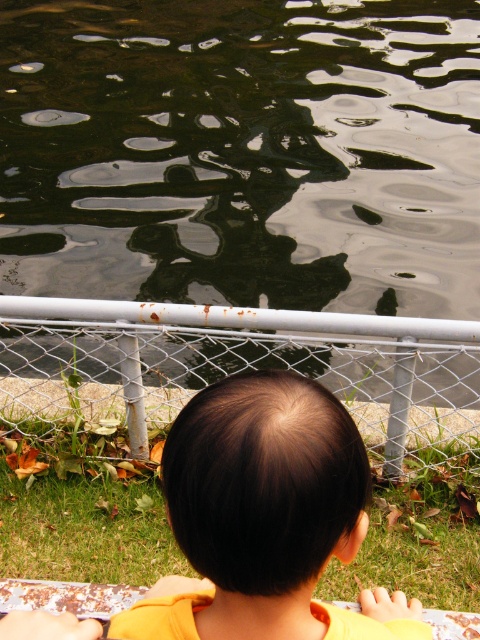
Question: Is glossy water at upper center closer to camera compared to brown hair at center?

Choices:
 (A) yes
 (B) no

Answer: (B)

Question: Which object is positioned closest to the rusty metal rail at center?

Choices:
 (A) glossy water at upper center
 (B) brown hair at center

Answer: (B)

Question: Which object is farther from the camera taking this photo?

Choices:
 (A) glossy water at upper center
 (B) rusty metal rail at center
 (C) brown hair at center

Answer: (A)

Question: Which object is positioned farthest from the glossy water at upper center?

Choices:
 (A) rusty metal rail at center
 (B) brown hair at center

Answer: (B)

Question: Is glossy water at upper center in front of rusty metal rail at center?

Choices:
 (A) no
 (B) yes

Answer: (A)

Question: Is glossy water at upper center further to camera compared to rusty metal rail at center?

Choices:
 (A) no
 (B) yes

Answer: (B)